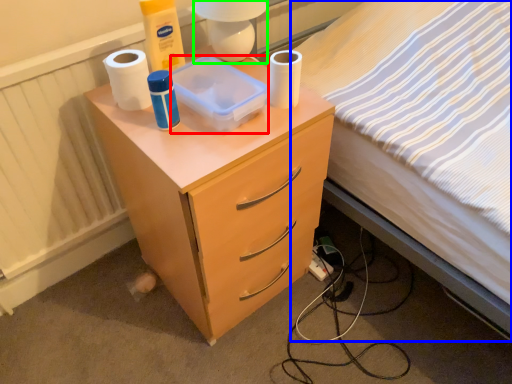
Question: Based on their relative distances, which object is farther from box (highlighted by a red box)? Choose from bed (highlighted by a blue box) and lamp (highlighted by a green box).

Choices:
 (A) bed
 (B) lamp

Answer: (A)